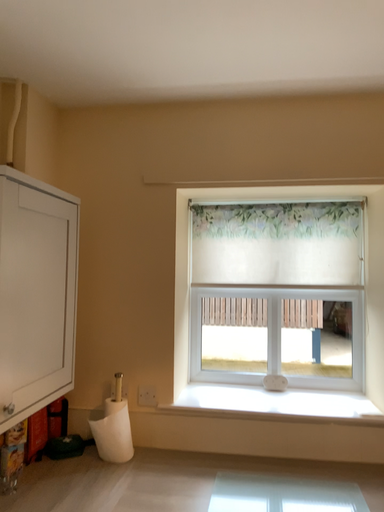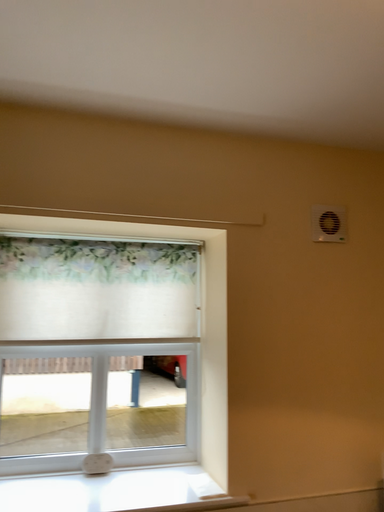
Question: How did the camera likely rotate when shooting the video?

Choices:
 (A) rotated right
 (B) rotated left

Answer: (A)